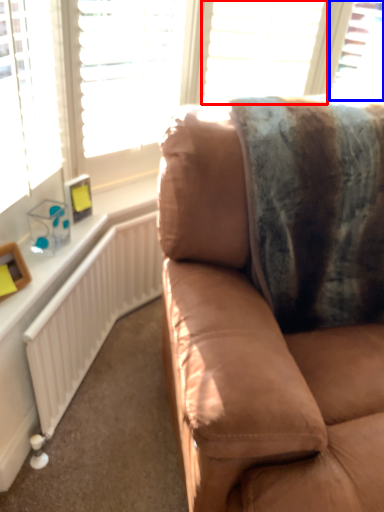
Question: Which point is further to the camera, blind (highlighted by a red box) or window (highlighted by a blue box)?

Choices:
 (A) blind
 (B) window

Answer: (B)